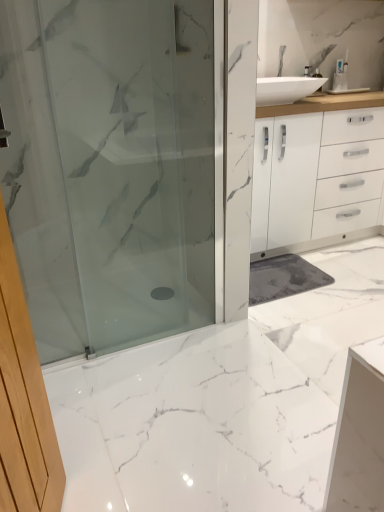
Question: Could you tell me if white marble floor at center is facing satin glass shower door at center?

Choices:
 (A) no
 (B) yes

Answer: (A)

Question: Can you confirm if white marble floor at center is positioned to the left of satin glass shower door at center?

Choices:
 (A) no
 (B) yes

Answer: (A)

Question: From a real-world perspective, is white marble floor at center under satin glass shower door at center?

Choices:
 (A) no
 (B) yes

Answer: (B)

Question: Can you confirm if white marble floor at center is thinner than satin glass shower door at center?

Choices:
 (A) no
 (B) yes

Answer: (A)

Question: Can we say white marble floor at center lies outside satin glass shower door at center?

Choices:
 (A) no
 (B) yes

Answer: (B)

Question: Does white marble floor at center appear on the right side of satin glass shower door at center?

Choices:
 (A) no
 (B) yes

Answer: (B)

Question: Is white plastic toothbrush at upper right not close to satin glass shower door at center?

Choices:
 (A) no
 (B) yes

Answer: (B)

Question: Considering the relative positions of white plastic toothbrush at upper right and satin glass shower door at center in the image provided, is white plastic toothbrush at upper right to the right of satin glass shower door at center from the viewer's perspective?

Choices:
 (A) no
 (B) yes

Answer: (B)

Question: Is white plastic toothbrush at upper right next to satin glass shower door at center and touching it?

Choices:
 (A) no
 (B) yes

Answer: (A)

Question: Can you confirm if white plastic toothbrush at upper right is bigger than satin glass shower door at center?

Choices:
 (A) yes
 (B) no

Answer: (B)

Question: Can satin glass shower door at center be found inside white plastic toothbrush at upper right?

Choices:
 (A) yes
 (B) no

Answer: (B)

Question: Does white plastic toothbrush at upper right have a lesser height compared to satin glass shower door at center?

Choices:
 (A) yes
 (B) no

Answer: (A)

Question: Would you say white marble floor at center is outside white plastic toothbrush at upper right?

Choices:
 (A) yes
 (B) no

Answer: (A)